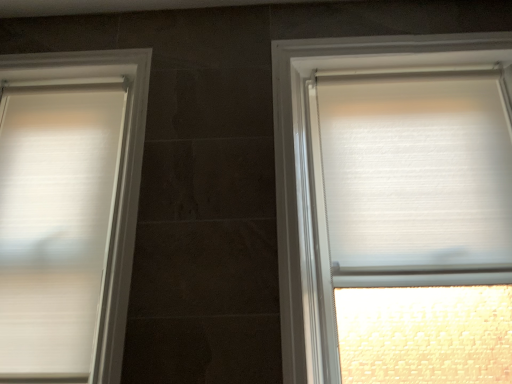
Question: Is white textured blind at right at the left side of white textured roller blind at right, which is the 1th window in right-to-left order?

Choices:
 (A) no
 (B) yes

Answer: (A)

Question: Is white textured blind at right facing away from white textured roller blind at right, which is counted as the 2th window, starting from the left?

Choices:
 (A) yes
 (B) no

Answer: (A)

Question: Can you confirm if white textured blind at right is wider than white textured roller blind at right, which is the 1th window in right-to-left order?

Choices:
 (A) no
 (B) yes

Answer: (A)

Question: Does white textured blind at right have a greater height compared to white textured roller blind at right, which is counted as the 2th window, starting from the left?

Choices:
 (A) no
 (B) yes

Answer: (A)

Question: Does white textured blind at right have a smaller size compared to white textured roller blind at right, which is the 1th window in right-to-left order?

Choices:
 (A) no
 (B) yes

Answer: (B)

Question: Is white textured roller blind at right, which is the 1th window in right-to-left order, wider or thinner than white matte blinds at left, arranged as the 2th window when viewed from the right?

Choices:
 (A) thin
 (B) wide

Answer: (B)

Question: Visually, is white textured roller blind at right, which is the 1th window in right-to-left order, positioned to the left or to the right of white matte blinds at left, acting as the 1th window starting from the left?

Choices:
 (A) left
 (B) right

Answer: (B)

Question: Considering the positions of white textured roller blind at right, which is the 1th window in right-to-left order, and white matte blinds at left, arranged as the 2th window when viewed from the right, in the image, is white textured roller blind at right, which is the 1th window in right-to-left order, taller or shorter than white matte blinds at left, arranged as the 2th window when viewed from the right,?

Choices:
 (A) short
 (B) tall

Answer: (B)

Question: Is white textured roller blind at right, which is counted as the 2th window, starting from the left, bigger or smaller than white matte blinds at left, acting as the 1th window starting from the left?

Choices:
 (A) small
 (B) big

Answer: (B)

Question: From the image's perspective, is white matte blinds at left, arranged as the 2th window when viewed from the right, above or below white textured blind at right?

Choices:
 (A) below
 (B) above

Answer: (A)

Question: From a real-world perspective, is white matte blinds at left, arranged as the 2th window when viewed from the right, positioned above or below white textured blind at right?

Choices:
 (A) above
 (B) below

Answer: (B)

Question: Is point pyautogui.click(x=89, y=332) positioned closer to the camera than point pyautogui.click(x=452, y=259)?

Choices:
 (A) closer
 (B) farther

Answer: (A)

Question: In the image, is white matte blinds at left, acting as the 1th window starting from the left, positioned in front of or behind white textured blind at right?

Choices:
 (A) behind
 (B) front

Answer: (B)

Question: Would you say white textured blind at right is inside or outside white textured roller blind at right, which is the 1th window in right-to-left order?

Choices:
 (A) outside
 (B) inside

Answer: (B)

Question: From a real-world perspective, is white textured blind at right physically located above or below white textured roller blind at right, which is the 1th window in right-to-left order?

Choices:
 (A) above
 (B) below

Answer: (A)